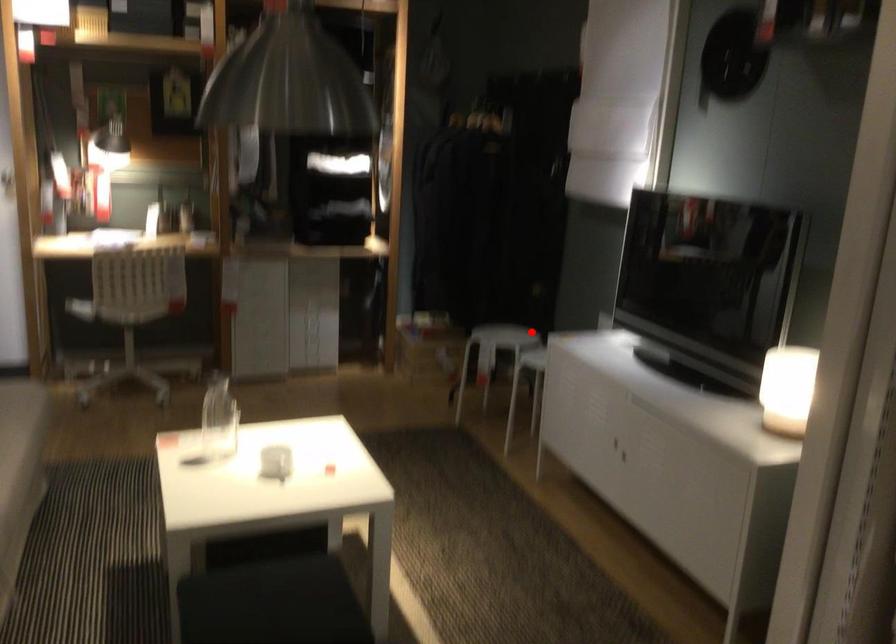
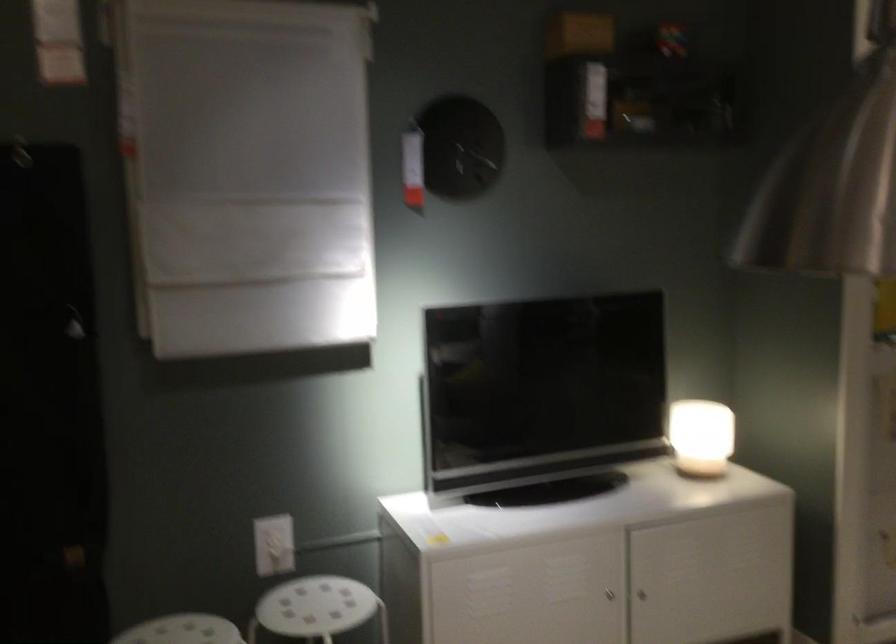
Question: I am providing you with two images of the same scene from different viewpoints. A red point is shown in image1. For the corresponding object point in image2, is it positioned nearer or farther from the camera?

Choices:
 (A) Nearer
 (B) Farther

Answer: (A)